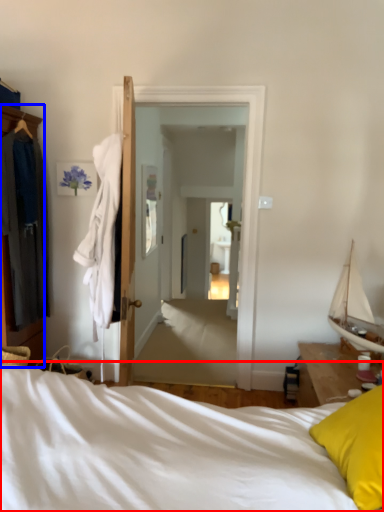
Question: Which point is further to the camera, bed (highlighted by a red box) or cabinetry (highlighted by a blue box)?

Choices:
 (A) bed
 (B) cabinetry

Answer: (B)